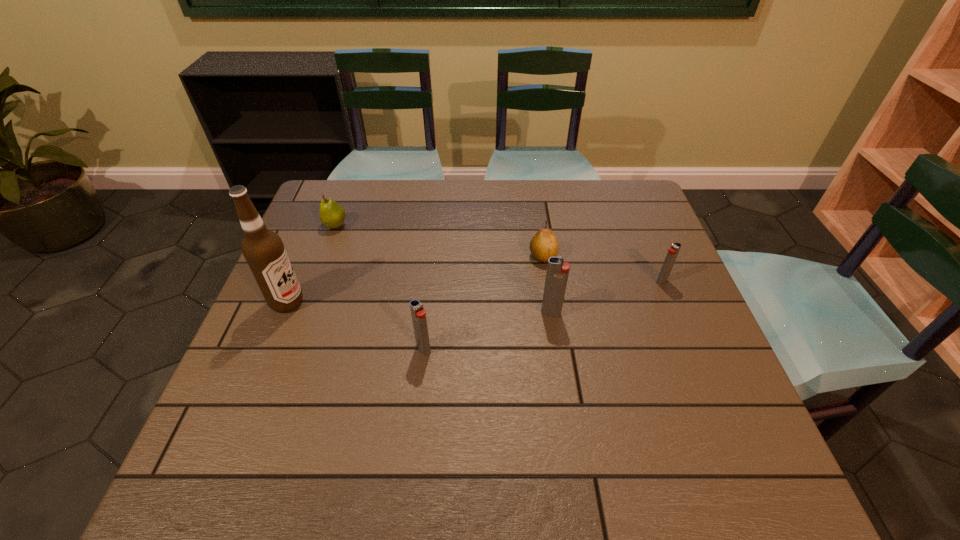
Where is `free area in between the fourth nearest object and the farther pear`? free area in between the fourth nearest object and the farther pear is located at coordinates (498, 253).

Where is `free space between the fourth object from right to left and the left pear`? The height and width of the screenshot is (540, 960). free space between the fourth object from right to left and the left pear is located at coordinates (379, 287).

Image resolution: width=960 pixels, height=540 pixels. Identify the location of free spot between the farthest object and the fourth nearest object. (498, 253).

The image size is (960, 540). I want to click on free spot between the left pear and the tallest object, so click(x=311, y=264).

Locate an element on the screen. free point between the farther pear and the fourth tallest object is located at coordinates (498, 253).

Where is `unoccupied area between the rightmost igniter and the nearest object`? The width and height of the screenshot is (960, 540). unoccupied area between the rightmost igniter and the nearest object is located at coordinates (542, 315).

The height and width of the screenshot is (540, 960). I want to click on object that is the fifth closest one to the right pear, so click(263, 249).

Locate which object is the second closest to the alcohol. Please provide its 2D coordinates. Your answer should be formatted as a tuple, i.e. [(x, y)], where the tuple contains the x and y coordinates of a point satisfying the conditions above.

[(418, 313)]

Identify which igniter is the nearest to the left pear. Please provide its 2D coordinates. Your answer should be formatted as a tuple, i.e. [(x, y)], where the tuple contains the x and y coordinates of a point satisfying the conditions above.

[(418, 313)]

Locate an element on the screen. This screenshot has width=960, height=540. the third closest igniter to the fifth nearest object is located at coordinates (418, 313).